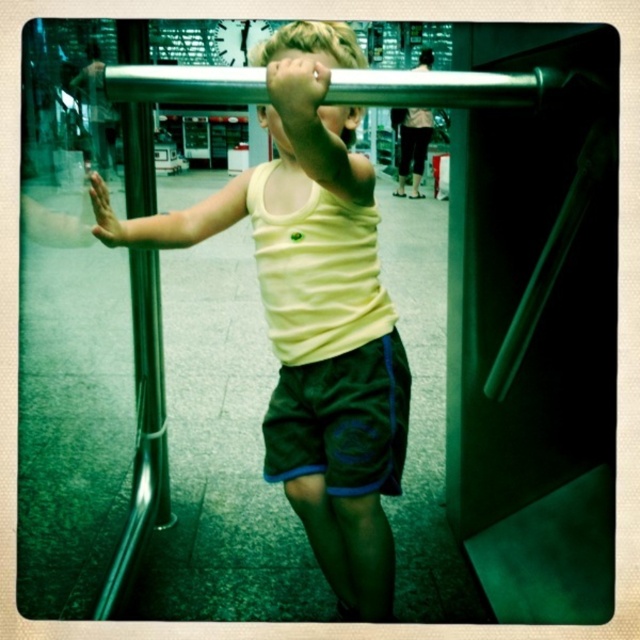
The boy is wearing a yellow matte tank top at center and dark blue cotton shorts at center. If the distance between them is 9.64 centimeters, can a 10cm ruler placed vertically from the tank top reach the shorts?

The distance between the yellow matte tank top at center and dark blue cotton shorts at center is 9.64 centimeters. Since the ruler is 10cm long, placing it vertically from the tank top would allow it to reach the shorts as 10cm is slightly longer than 9.64cm.

You are a fashion designer analyzing clothing items in an image. You see the dark blue cotton shorts at center and the dark gray pants at upper center. Which clothing item takes up more visual space in the image?

The dark gray pants at upper center occupies more visual space than the dark blue cotton shorts at center.

Based on the scene described, which object is positioned to the left when comparing dark blue cotton shorts at center and dark gray pants at upper center?

dark blue cotton shorts at center is to the left of dark gray pants at upper center according to the description.